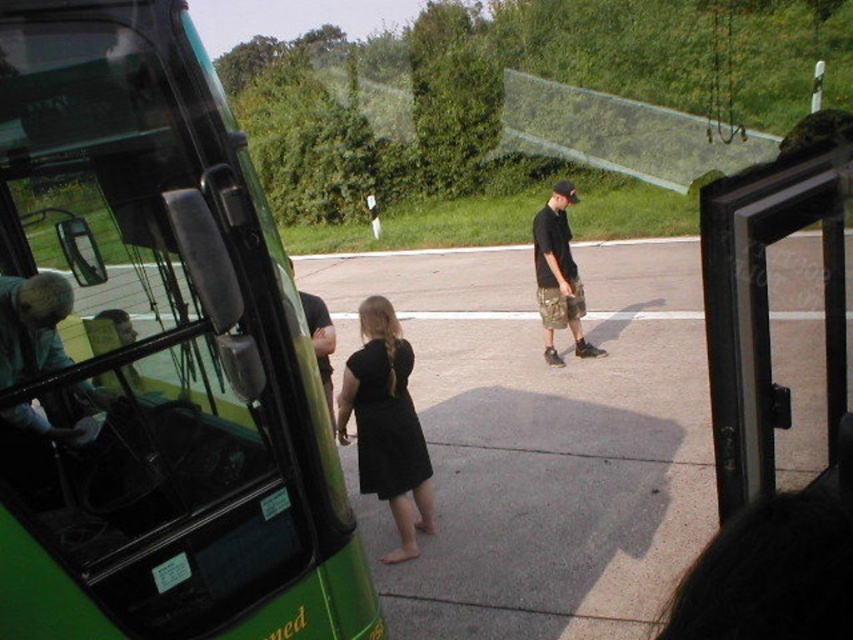
Question: Is black matte dress at center positioned in front of dark blue shirt at center?

Choices:
 (A) no
 (B) yes

Answer: (A)

Question: Is green matte bus at left wider than dark blue shirt at center?

Choices:
 (A) no
 (B) yes

Answer: (B)

Question: Does green matte bus at left have a smaller size compared to black matte dress at center?

Choices:
 (A) yes
 (B) no

Answer: (B)

Question: Which is farther from the camo shorts at center?

Choices:
 (A) green matte bus at left
 (B) black matte dress at center
 (C) transparent glass door at center
 (D) dark blue shirt at center

Answer: (A)

Question: Among these points, which one is farthest from the camera?

Choices:
 (A) pyautogui.click(x=808, y=188)
 (B) pyautogui.click(x=389, y=438)
 (C) pyautogui.click(x=544, y=330)
 (D) pyautogui.click(x=326, y=349)

Answer: (C)

Question: Which object appears farthest from the camera in this image?

Choices:
 (A) dark blue shirt at center
 (B) transparent glass door at center
 (C) black matte dress at center
 (D) camo shorts at center

Answer: (D)